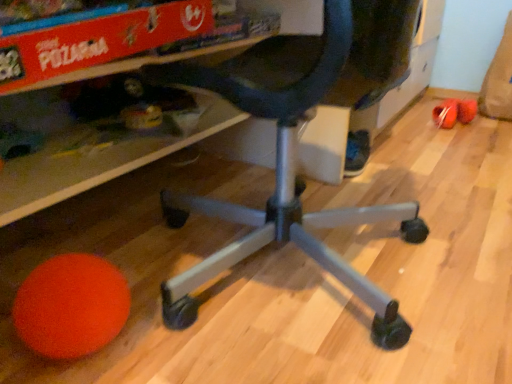
Question: From a real-world perspective, is orange matte ball at lower left located higher than black matte office chair at center?

Choices:
 (A) no
 (B) yes

Answer: (A)

Question: Does orange matte ball at lower left lie in front of black matte office chair at center?

Choices:
 (A) yes
 (B) no

Answer: (B)

Question: Is orange matte ball at lower left further to the viewer compared to black matte office chair at center?

Choices:
 (A) no
 (B) yes

Answer: (B)

Question: Would you say orange matte ball at lower left is outside black matte office chair at center?

Choices:
 (A) yes
 (B) no

Answer: (A)

Question: From a real-world perspective, is orange matte ball at lower left located beneath black matte office chair at center?

Choices:
 (A) no
 (B) yes

Answer: (B)

Question: Is black matte office chair at center located within orange matte ball at lower left?

Choices:
 (A) yes
 (B) no

Answer: (B)

Question: Considering the relative positions of orange matte ball at lower left and rubberized plastic ball at lower left in the image provided, is orange matte ball at lower left in front of rubberized plastic ball at lower left?

Choices:
 (A) yes
 (B) no

Answer: (A)

Question: Considering the relative sizes of orange matte ball at lower left and rubberized plastic ball at lower left in the image provided, is orange matte ball at lower left taller than rubberized plastic ball at lower left?

Choices:
 (A) yes
 (B) no

Answer: (A)

Question: Does orange matte ball at lower left have a lesser width compared to rubberized plastic ball at lower left?

Choices:
 (A) yes
 (B) no

Answer: (A)

Question: Does orange matte ball at lower left have a smaller size compared to rubberized plastic ball at lower left?

Choices:
 (A) yes
 (B) no

Answer: (B)

Question: Is orange matte ball at lower left wider than rubberized plastic ball at lower left?

Choices:
 (A) yes
 (B) no

Answer: (B)

Question: Is orange matte ball at lower left beside rubberized plastic ball at lower left?

Choices:
 (A) no
 (B) yes

Answer: (A)

Question: Considering the relative sizes of black matte office chair at center and orange matte ball at lower left in the image provided, is black matte office chair at center wider than orange matte ball at lower left?

Choices:
 (A) yes
 (B) no

Answer: (A)